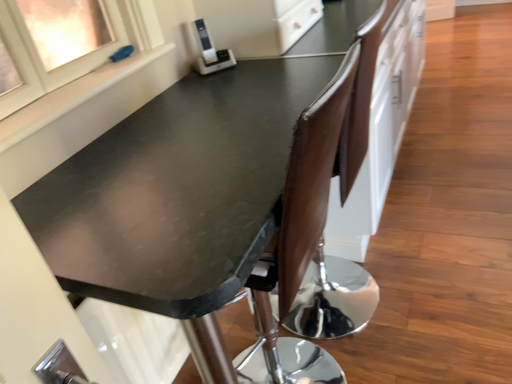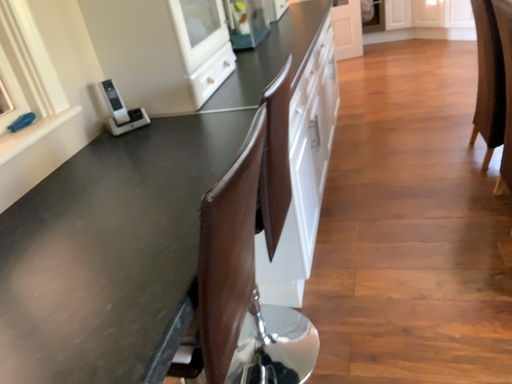
Question: How did the camera likely rotate when shooting the video?

Choices:
 (A) rotated left
 (B) rotated right

Answer: (B)